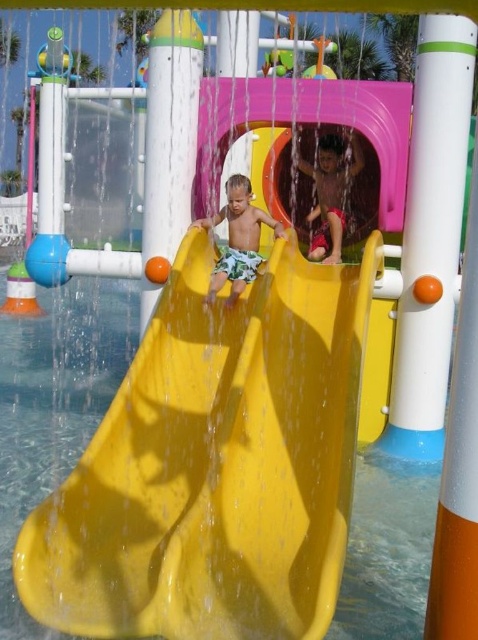
You are a photographer positioned at the entrance of the water park. You want to capture a photo of the matte red shorts at center and the matte yellow slide at center. Which object will appear closer to you in the photo?

The matte red shorts at center will appear closer to you in the photo because it is positioned further to the viewer than the matte yellow slide at center.

You are designing a water park layout and need to place both the yellow plastic slide at center and the matte yellow slide at center side by side. Based on their widths, which slide should be placed on the left to ensure there is enough space between them?

The yellow plastic slide at center is wider than the matte yellow slide at center, so placing the wider slide on the left would allow for adequate spacing between them.

You are standing at the entrance of the water park and see the bright yellow slide with two children. One child is wearing green swim trunks and is halfway down the slide, while the other is at the top, preparing to slide down. There is also a point marked at coordinates point (330, 193). What color shorts is the child wearing at that point?

The point (330, 193) corresponds to the matte red shorts at center, so the child wearing matte red shorts at center is wearing red shorts.